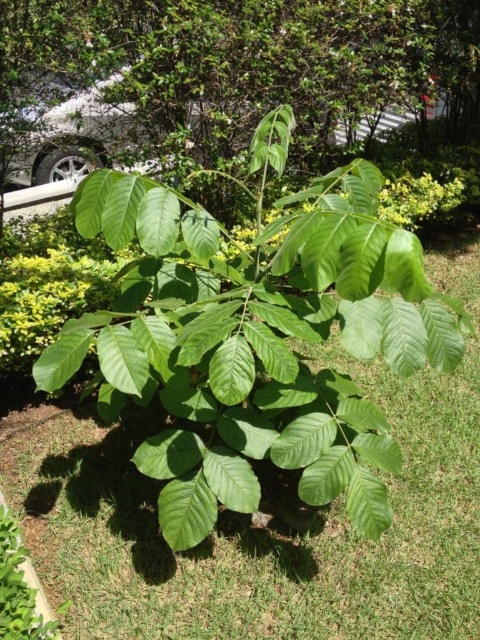
Based on the photo, does green grass at center appear on the left side of silver metallic car at upper left?

Incorrect, green grass at center is not on the left side of silver metallic car at upper left.

Who is taller, green grass at center or silver metallic car at upper left?

green grass at center

Locate an element on the screen. green grass at center is located at coordinates (253, 525).

Can you confirm if green leafy tree at center is positioned above silver metallic car at upper left?

Yes, green leafy tree at center is above silver metallic car at upper left.

Does green leafy tree at center have a smaller size compared to silver metallic car at upper left?

No.

Does point (47, 36) come in front of point (81, 124)?

Yes, point (47, 36) is closer to viewer.

At what (x,y) coordinates should I click in order to perform the action: click on green leafy tree at center. Please return your answer as a coordinate pair (x, y). Looking at the image, I should click on (250, 61).

Is point (105, 570) positioned after point (462, 76)?

No.

Which is below, green grass at center or green leafy tree at center?

Positioned lower is green grass at center.

Is point (403, 564) positioned in front of point (133, 67)?

Yes, it is.

This screenshot has width=480, height=640. I want to click on green grass at center, so click(x=253, y=525).